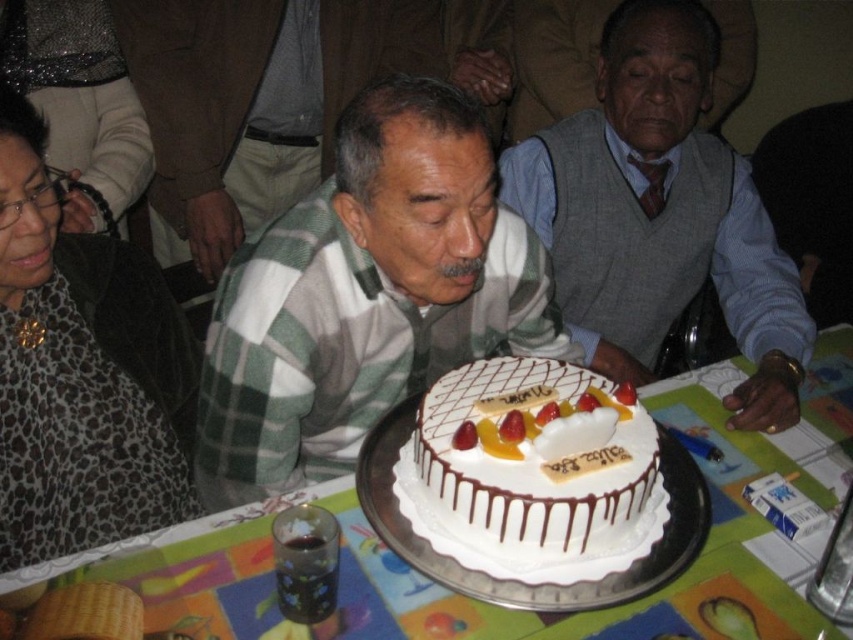
You are a photographer at the birthday party and want to capture a clear shot of both the leopard print scarf at upper left and the white frosted cake at center. Can you adjust your camera angle so that neither object blocks the other?

The leopard print scarf at upper left is positioned over white frosted cake at center, so adjusting the camera angle might not be sufficient to avoid blocking the cake. You may need to physically move the scarf or reposition the cake to ensure both are visible clearly.

You are at the birthday party and want to place a gift on the white paper table at center. Where should you stand relative to the white textured sweater at center to do so?

You should stand to the right of the white textured sweater at center because the white paper table at center is located to the right of it.

You are a guest at the birthday party and want to place a gift on the table. Can you fit the gift on the white paper table at center if the gift is the size of the white textured sweater at center?

The white paper table at center occupies less space than white textured sweater at center, so the gift will not fit on the table.